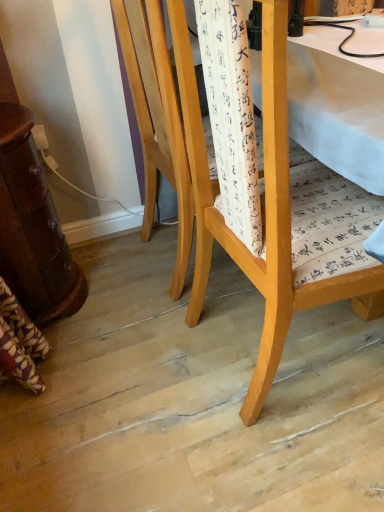
I want to click on free space in front of light wood chair at center, the 2th chair viewed from the back, so click(295, 451).